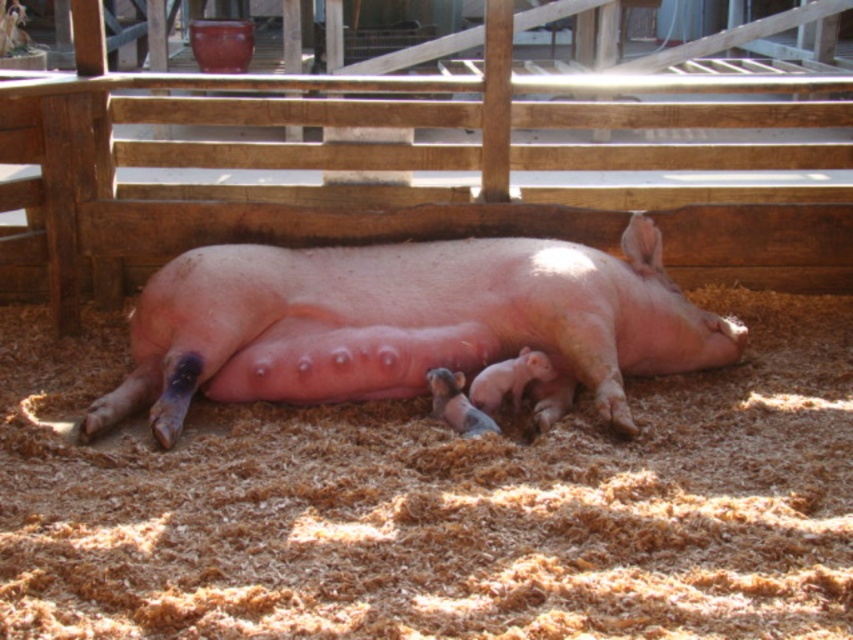
Question: Which point is closer to the camera?

Choices:
 (A) pink smooth pig at center
 (B) brown sawdust at center

Answer: (B)

Question: Is brown sawdust at center further to camera compared to pink smooth pig at center?

Choices:
 (A) yes
 (B) no

Answer: (B)

Question: Which point is farther to the camera?

Choices:
 (A) pink smooth pig at center
 (B) brown sawdust at center

Answer: (A)

Question: Is brown sawdust at center further to the viewer compared to pink smooth pig at center?

Choices:
 (A) no
 (B) yes

Answer: (A)

Question: Is brown sawdust at center below pink smooth pig at center?

Choices:
 (A) no
 (B) yes

Answer: (B)